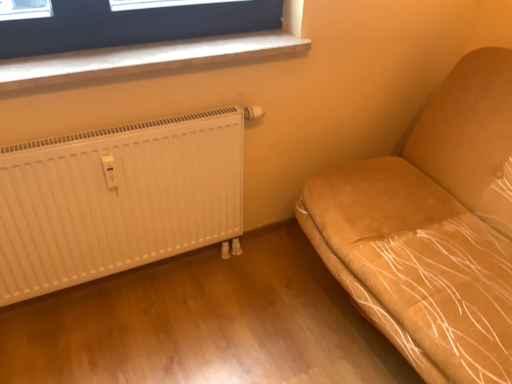
Question: Is point (16, 72) positioned closer to the camera than point (298, 210)?

Choices:
 (A) farther
 (B) closer

Answer: (B)

Question: Is white plastic window sill at upper left to the left or to the right of suede-like tan sofa at right in the image?

Choices:
 (A) left
 (B) right

Answer: (A)

Question: Considering the real-world distances, which object is farthest from the white ribbed radiator at lower left?

Choices:
 (A) suede-like tan sofa at right
 (B) white plastic window sill at upper left

Answer: (A)

Question: Which object is positioned farthest from the suede-like tan sofa at right?

Choices:
 (A) white ribbed radiator at lower left
 (B) white plastic window sill at upper left

Answer: (B)